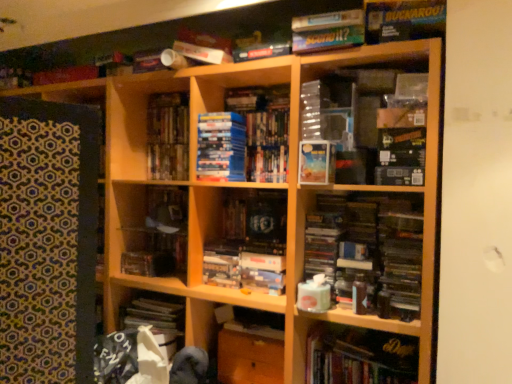
Question: Is hardcover book at lower right, acting as the sixth book starting from the top, behind wooden cabinet at center, which ranks as the second cabinet in left-to-right order?

Choices:
 (A) yes
 (B) no

Answer: (B)

Question: Considering the relative sizes of hardcover book at lower right, arranged as the first book when ordered from the bottom, and wooden cabinet at center, which ranks as the second cabinet in left-to-right order, in the image provided, is hardcover book at lower right, arranged as the first book when ordered from the bottom, bigger than wooden cabinet at center, which ranks as the second cabinet in left-to-right order,?

Choices:
 (A) no
 (B) yes

Answer: (B)

Question: From a real-world perspective, is hardcover book at lower right, arranged as the first book when ordered from the bottom, under wooden cabinet at center, which ranks as the second cabinet in left-to-right order?

Choices:
 (A) yes
 (B) no

Answer: (B)

Question: Does hardcover book at lower right, acting as the sixth book starting from the top, have a smaller size compared to wooden cabinet at center, the 2th cabinet positioned from the top?

Choices:
 (A) yes
 (B) no

Answer: (B)

Question: Is wooden cabinet at center, which ranks as the second cabinet in left-to-right order, at the back of hardcover book at lower right, acting as the sixth book starting from the top?

Choices:
 (A) no
 (B) yes

Answer: (A)

Question: Relative to matte board game at upper center, the 6th book in the bottom-to-top sequence, is matte blue paperback book at center in front or behind?

Choices:
 (A) behind
 (B) front

Answer: (A)

Question: Is point click(x=322, y=165) closer or farther from the camera than point click(x=362, y=43)?

Choices:
 (A) farther
 (B) closer

Answer: (A)

Question: Is matte blue paperback book at center taller or shorter than matte board game at upper center, which is the 1th book in top-to-bottom order?

Choices:
 (A) tall
 (B) short

Answer: (A)

Question: From the image's perspective, relative to matte board game at upper center, which is the 1th book in top-to-bottom order, is matte blue paperback book at center above or below?

Choices:
 (A) above
 (B) below

Answer: (B)

Question: Visually, is hardcover books at center, which ranks as the 3th book in top-to-bottom order, positioned to the left or to the right of matte blue paperback book at center?

Choices:
 (A) left
 (B) right

Answer: (A)

Question: Is hardcover books at center, marked as the fourth book in a bottom-to-top arrangement, inside or outside of matte blue paperback book at center?

Choices:
 (A) inside
 (B) outside

Answer: (B)

Question: From the image's perspective, is hardcover books at center, marked as the fourth book in a bottom-to-top arrangement, positioned above or below matte blue paperback book at center?

Choices:
 (A) above
 (B) below

Answer: (A)

Question: Considering the positions of hardcover books at center, marked as the fourth book in a bottom-to-top arrangement, and matte blue paperback book at center in the image, is hardcover books at center, marked as the fourth book in a bottom-to-top arrangement, bigger or smaller than matte blue paperback book at center?

Choices:
 (A) small
 (B) big

Answer: (B)

Question: Based on their sizes in the image, would you say matte blue paperback book at center is bigger or smaller than wooden cabinet at center, the 2th cabinet positioned from the top?

Choices:
 (A) small
 (B) big

Answer: (A)

Question: Is matte blue paperback book at center taller or shorter than wooden cabinet at center, which is the 1th cabinet from bottom to top?

Choices:
 (A) tall
 (B) short

Answer: (B)